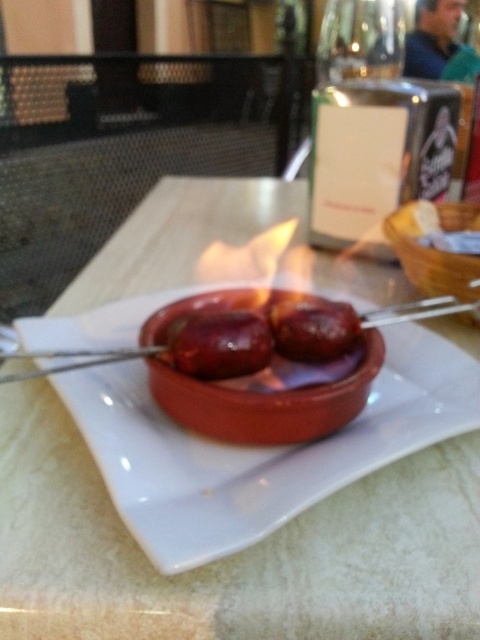
Does point (143, 342) lie in front of point (465, 209)?

Yes, it is.

Does matte clay bowl at center appear on the right side of matte ceramic bowl at center?

No, matte clay bowl at center is not to the right of matte ceramic bowl at center.

Image resolution: width=480 pixels, height=640 pixels. What do you see at coordinates (264, 403) in the screenshot?
I see `matte clay bowl at center` at bounding box center [264, 403].

Find the location of a particular element. matte clay bowl at center is located at coordinates (264, 403).

In the scene shown: Is matte clay bowl at center positioned behind glossy brown sausage at center?

That is False.

Does matte clay bowl at center appear on the right side of glossy brown sausage at center?

Incorrect, matte clay bowl at center is not on the right side of glossy brown sausage at center.

The height and width of the screenshot is (640, 480). What do you see at coordinates (264, 403) in the screenshot?
I see `matte clay bowl at center` at bounding box center [264, 403].

Where is `matte clay bowl at center`? This screenshot has height=640, width=480. matte clay bowl at center is located at coordinates 264,403.

Which of these two, smooth brown sausage at center or matte ceramic bowl at center, stands taller?

With more height is matte ceramic bowl at center.

Based on the photo, does smooth brown sausage at center appear on the left side of matte ceramic bowl at center?

Indeed, smooth brown sausage at center is positioned on the left side of matte ceramic bowl at center.

Is point (170, 340) positioned behind point (391, 241)?

That is False.

Where is `smooth brown sausage at center`? This screenshot has width=480, height=640. smooth brown sausage at center is located at coordinates (217, 342).